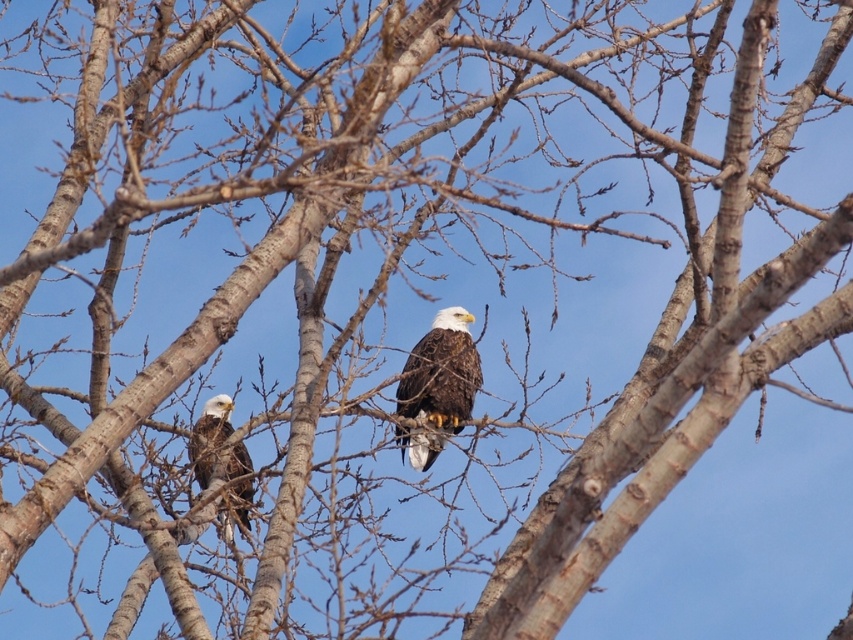
Is brown feathered eagle at center positioned behind dark brown feathers at center?

Yes, it is behind dark brown feathers at center.

From the picture: Between brown feathered eagle at center and dark brown feathers at center, which one has more height?

brown feathered eagle at center is taller.

Which is in front, point (463, 316) or point (228, 465)?

Point (228, 465) is more forward.

The image size is (853, 640). I want to click on brown feathered eagle at center, so tap(438, 385).